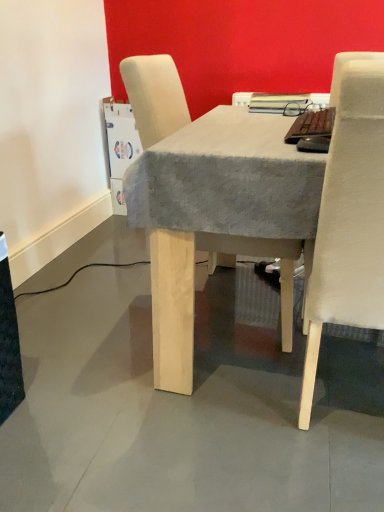
Question: From their relative heights in the image, would you say beige fabric chair at center, positioned as the second chair in right-to-left order, is taller or shorter than beige fabric chair at right, arranged as the 2th chair when viewed from the left?

Choices:
 (A) tall
 (B) short

Answer: (B)

Question: Considering the positions of beige fabric chair at center, positioned as the second chair in right-to-left order, and beige fabric chair at right, arranged as the 2th chair when viewed from the left, in the image, is beige fabric chair at center, positioned as the second chair in right-to-left order, wider or thinner than beige fabric chair at right, arranged as the 2th chair when viewed from the left,?

Choices:
 (A) wide
 (B) thin

Answer: (A)

Question: Would you say beige fabric chair at center, positioned as the second chair in right-to-left order, is inside or outside beige fabric chair at right, arranged as the 2th chair when viewed from the left?

Choices:
 (A) outside
 (B) inside

Answer: (A)

Question: Considering the positions of point (342, 265) and point (147, 61), is point (342, 265) closer or farther from the camera than point (147, 61)?

Choices:
 (A) closer
 (B) farther

Answer: (A)

Question: Considering their positions, is beige fabric chair at right, arranged as the 2th chair when viewed from the left, located in front of or behind beige fabric chair at center, the first chair in the left-to-right sequence?

Choices:
 (A) front
 (B) behind

Answer: (A)

Question: Considering the positions of beige fabric chair at right, placed as the first chair when sorted from right to left, and beige fabric chair at center, positioned as the second chair in right-to-left order, in the image, is beige fabric chair at right, placed as the first chair when sorted from right to left, wider or thinner than beige fabric chair at center, positioned as the second chair in right-to-left order,?

Choices:
 (A) thin
 (B) wide

Answer: (A)

Question: Based on their positions, is beige fabric chair at right, arranged as the 2th chair when viewed from the left, located to the left or right of beige fabric chair at center, positioned as the second chair in right-to-left order?

Choices:
 (A) left
 (B) right

Answer: (B)